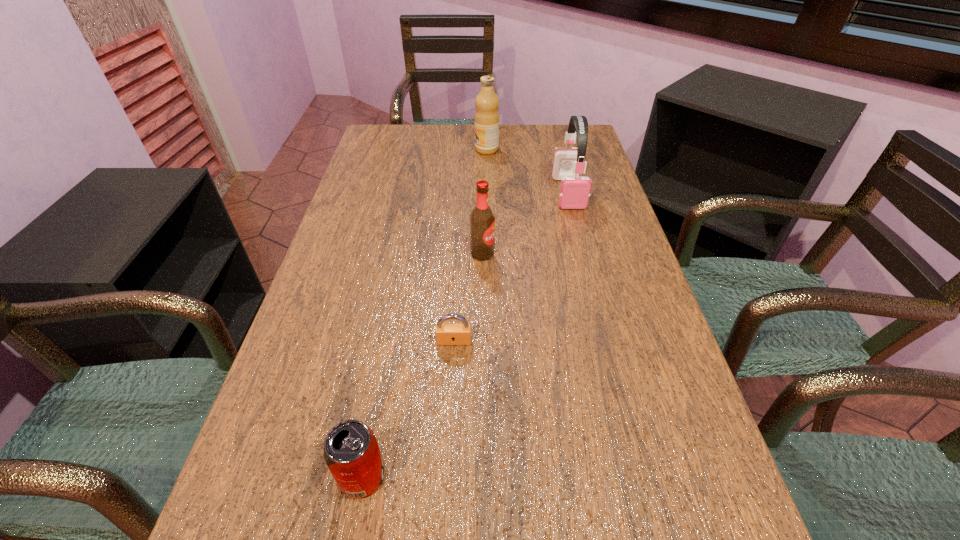
Where is `free space at the right edge of the desktop`? free space at the right edge of the desktop is located at coordinates (604, 417).

I want to click on unoccupied position between the beer bottle and the padlock, so click(468, 298).

Identify the location of vacant area that lies between the beer bottle and the fourth farthest object. (468, 298).

I want to click on unoccupied area between the nearest object and the olive oil, so click(x=424, y=313).

Find the location of a particular element. This screenshot has width=960, height=540. vacant area that lies between the fourth tallest object and the olive oil is located at coordinates (424, 313).

In order to click on vacant space in between the padlock and the third farthest object in this screenshot , I will do `click(468, 298)`.

Find the location of a particular element. blank region between the earphone and the fourth farthest object is located at coordinates (511, 267).

Find the location of `vacant point located between the beer bottle and the fourth nearest object`. vacant point located between the beer bottle and the fourth nearest object is located at coordinates (525, 223).

At what (x,y) coordinates should I click in order to perform the action: click on empty location between the beer bottle and the second farthest object. Please return your answer as a coordinate pair (x, y). Image resolution: width=960 pixels, height=540 pixels. Looking at the image, I should click on (525, 223).

Point out which object is positioned as the third nearest to the nearest object. Please provide its 2D coordinates. Your answer should be formatted as a tuple, i.e. [(x, y)], where the tuple contains the x and y coordinates of a point satisfying the conditions above.

[(574, 193)]